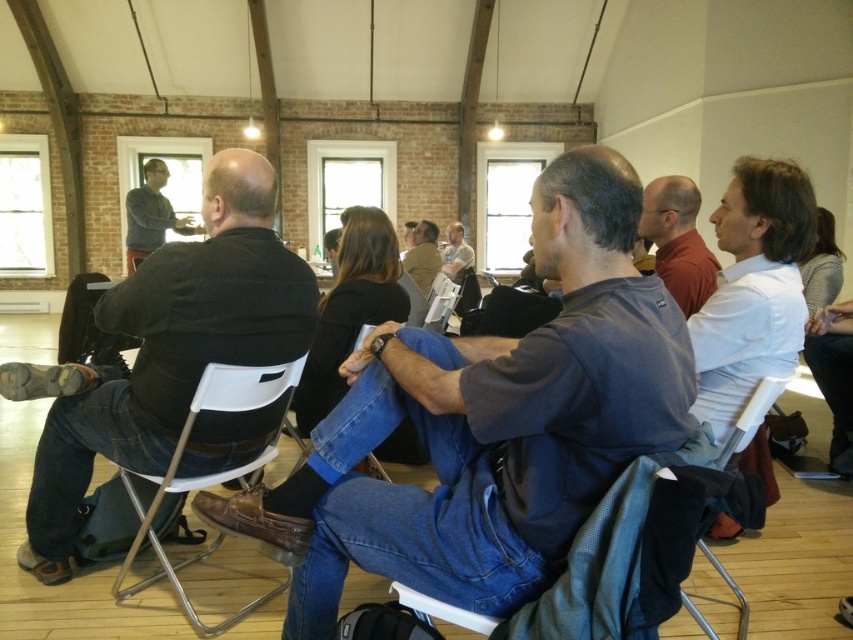
Question: Which object is positioned farthest from the white plastic chair at center?

Choices:
 (A) black leather jacket at left
 (B) matte red shirt at center

Answer: (A)

Question: Among these objects, which one is farthest from the camera?

Choices:
 (A) white plastic chair at center
 (B) gray sweater at upper left
 (C) matte red shirt at center

Answer: (B)

Question: Can you confirm if black leather jacket at left is positioned to the right of white plastic chair at lower left?

Choices:
 (A) no
 (B) yes

Answer: (A)

Question: From the image, what is the correct spatial relationship of black leather jacket at left in relation to gray sweater at upper left?

Choices:
 (A) left
 (B) right

Answer: (B)

Question: Where is white plastic chair at lower left located in relation to white plastic chair at center in the image?

Choices:
 (A) above
 (B) below

Answer: (A)

Question: Among these objects, which one is farthest from the camera?

Choices:
 (A) white plastic chair at lower left
 (B) gray sweater at upper left

Answer: (B)